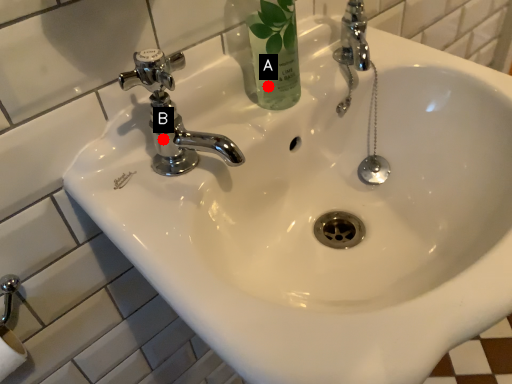
Question: Two points are circled on the image, labeled by A and B beside each circle. Which of the following is the farthest from the observer?

Choices:
 (A) A is further
 (B) B is further

Answer: (A)